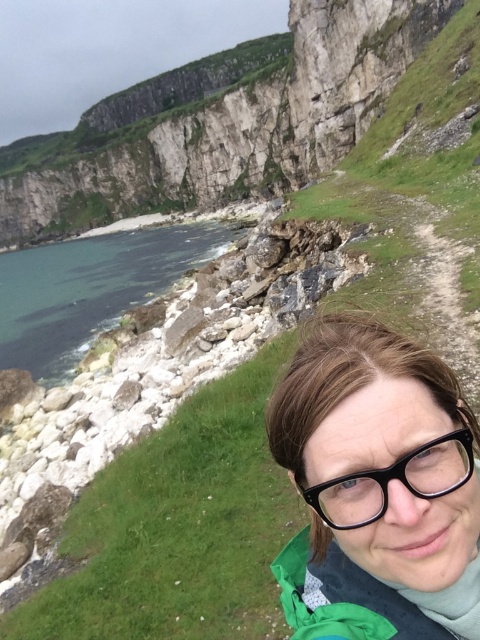
Question: Does greenish water at lower left have a larger size compared to black plastic glasses at center?

Choices:
 (A) yes
 (B) no

Answer: (A)

Question: Is smooth rock cliff at upper center in front of black plastic glasses at center?

Choices:
 (A) yes
 (B) no

Answer: (B)

Question: Does greenish water at lower left appear on the left side of black plastic glasses at center?

Choices:
 (A) yes
 (B) no

Answer: (A)

Question: Which object appears closest to the camera in this image?

Choices:
 (A) matte black glasses at lower right
 (B) smooth rock cliff at upper center
 (C) greenish water at lower left

Answer: (A)

Question: Which of the following is the closest to the observer?

Choices:
 (A) (308, 10)
 (B) (432, 456)
 (C) (374, 476)
 (D) (56, 248)

Answer: (C)

Question: Based on their relative distances, which object is farther from the matte black glasses at lower right?

Choices:
 (A) greenish water at lower left
 (B) black plastic glasses at center

Answer: (A)